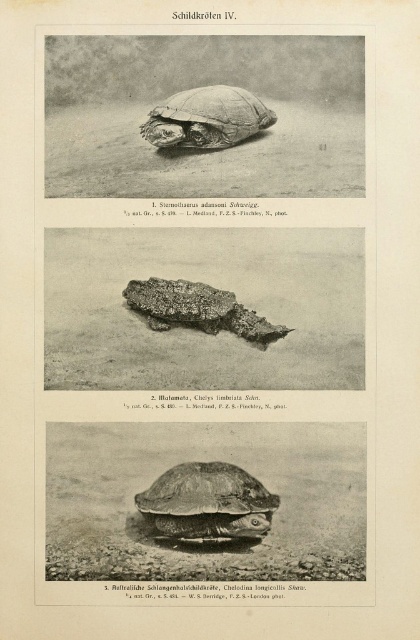
Question: Is brown textured shell at center above rough textured shell at center?

Choices:
 (A) yes
 (B) no

Answer: (B)

Question: Is brown textured shell at center thinner than rough textured tortoise at center?

Choices:
 (A) yes
 (B) no

Answer: (B)

Question: Can you confirm if brown textured shell at center is positioned below rough textured shell at center?

Choices:
 (A) yes
 (B) no

Answer: (A)

Question: Which point is farther to the camera?

Choices:
 (A) rough textured tortoise at center
 (B) rough textured shell at center

Answer: (B)

Question: Which of the following is the closest to the observer?

Choices:
 (A) (236, 92)
 (B) (178, 307)

Answer: (A)

Question: Which point appears closest to the camera in this image?

Choices:
 (A) (184, 474)
 (B) (231, 317)
 (C) (236, 131)

Answer: (A)